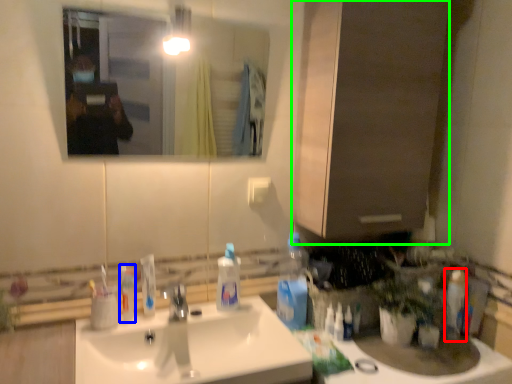
Question: Which object is the farthest from toiletry (highlighted by a red box)? Choose among these: mouthwash (highlighted by a blue box) or cabinetry (highlighted by a green box).

Choices:
 (A) mouthwash
 (B) cabinetry

Answer: (A)